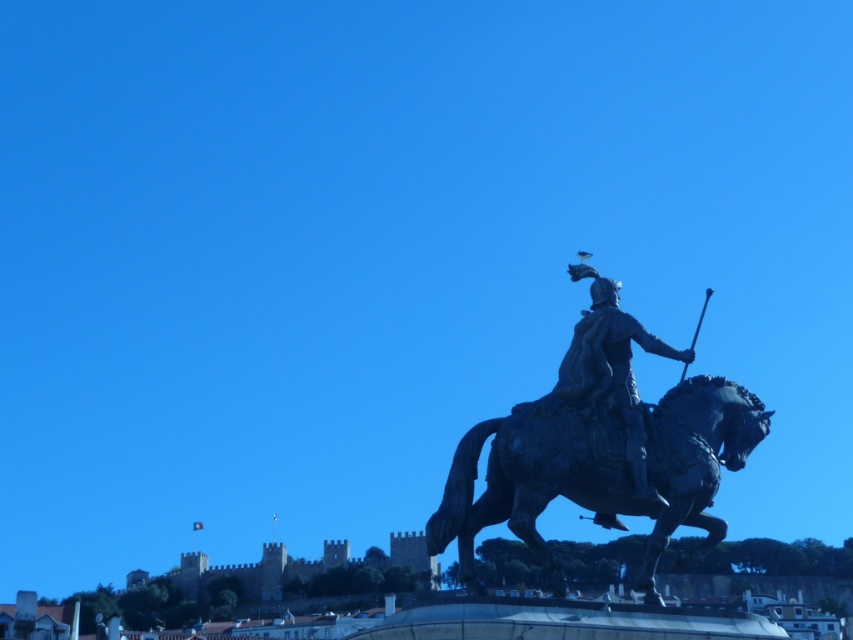
Does shiny black horse at center have a smaller size compared to polished bronze statue at center?

Incorrect, shiny black horse at center is not smaller in size than polished bronze statue at center.

Between point (555, 474) and point (596, 372), which one is positioned behind?

Point (596, 372)

Is point (459, 509) less distant than point (607, 326)?

Yes, point (459, 509) is in front of point (607, 326).

Identify the location of shiny black horse at center. The image size is (853, 640). (599, 472).